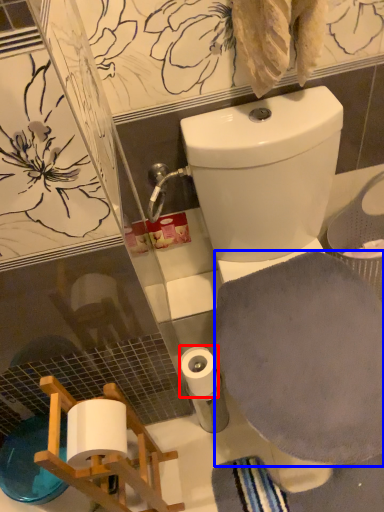
Question: Which of the following is the closest to the observer, toilet paper (highlighted by a red box) or bath towel (highlighted by a blue box)?

Choices:
 (A) toilet paper
 (B) bath towel

Answer: (B)